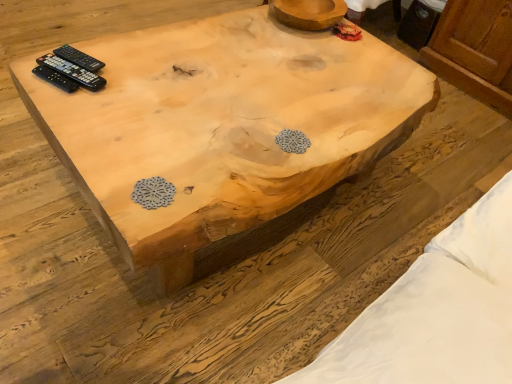
The image size is (512, 384). I want to click on vacant space to the right of black plastic remote at upper left, the 3th remote control when ordered from back to front, so click(123, 89).